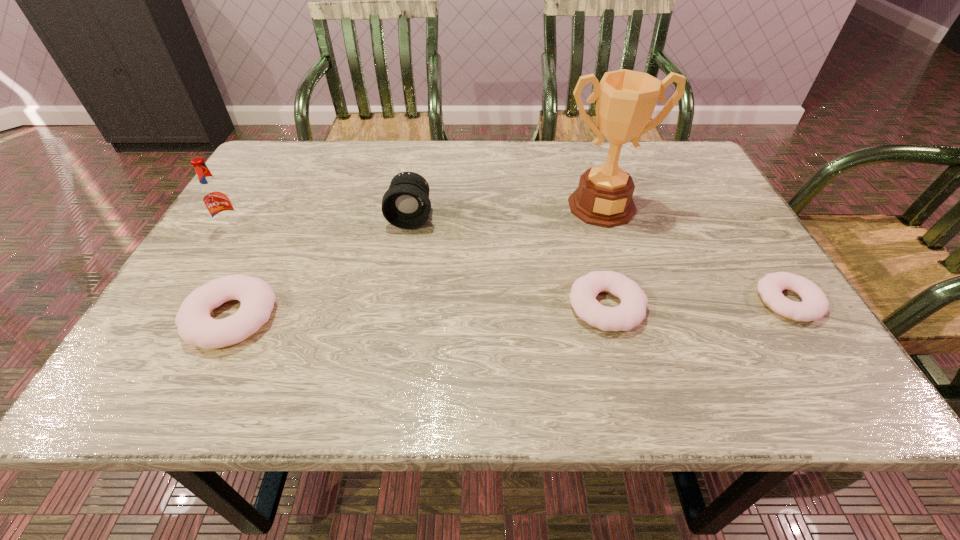
At what (x,y) coordinates should I click in order to perform the action: click on doughnut that is the closest to the leftmost doughnut. Please return your answer as a coordinate pair (x, y). Looking at the image, I should click on (631, 312).

Locate an element on the screen. This screenshot has height=540, width=960. free space that satisfies the following two spatial constraints: 1. at the front element of the second shortest doughnut; 2. on the left side of the third object from left to right is located at coordinates (395, 307).

In order to click on vacant point that satisfies the following two spatial constraints: 1. on the back side of the rightmost doughnut; 2. on the right side of the leftmost doughnut in this screenshot , I will do `click(239, 301)`.

Identify the location of vacant space that satisfies the following two spatial constraints: 1. on the front side of the leftmost doughnut; 2. on the left side of the second tallest object. click(x=179, y=317).

Locate an element on the screen. free location that satisfies the following two spatial constraints: 1. on the front side of the root beer; 2. on the right side of the leftmost doughnut is located at coordinates (179, 317).